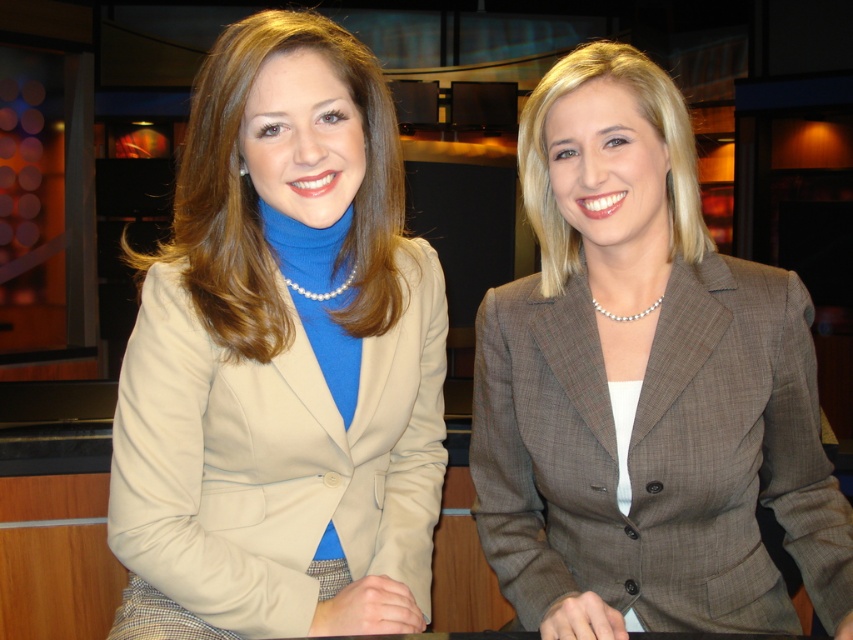
Is matte beige blazer at center thinner than gray plaid blazer at center?

Yes, matte beige blazer at center is thinner than gray plaid blazer at center.

Is point (399, 611) positioned after point (747, 506)?

No, (399, 611) is closer to viewer.

Locate an element on the screen. matte beige blazer at center is located at coordinates pos(281,358).